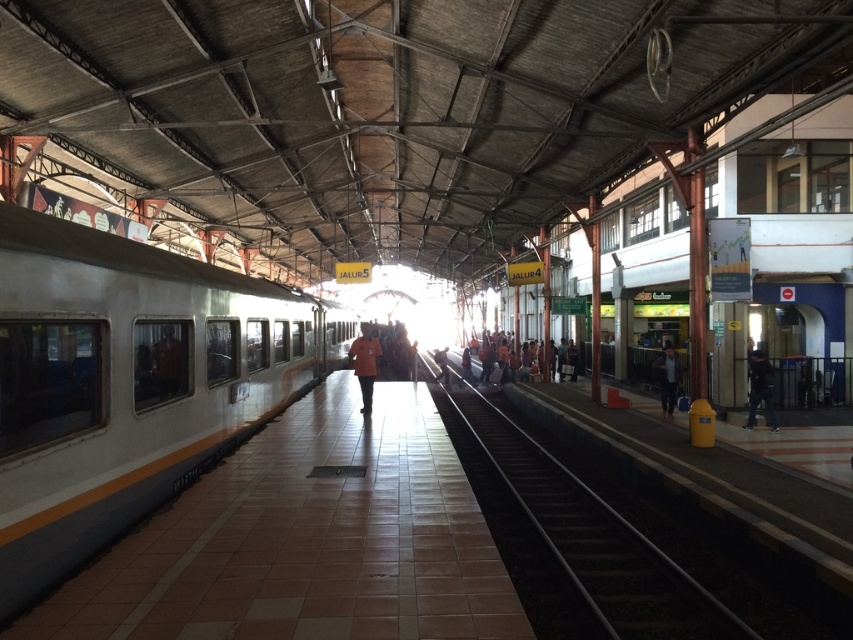
Question: Does silver metallic train at left have a smaller size compared to black matte person at right?

Choices:
 (A) no
 (B) yes

Answer: (A)

Question: Which point appears farthest from the camera in this image?

Choices:
 (A) (355, 340)
 (B) (674, 365)
 (C) (637, 548)

Answer: (B)

Question: Considering the real-world distances, which object is farthest from the dark blue jeans at lower right?

Choices:
 (A) orange fabric shirt at center
 (B) black matte person at right
 (C) orange fabric people at center

Answer: (A)

Question: Where is silver metallic train at left located in relation to orange fabric people at center in the image?

Choices:
 (A) below
 (B) above

Answer: (B)

Question: Does black matte person at right appear over dark blue jeans at lower right?

Choices:
 (A) yes
 (B) no

Answer: (B)

Question: Which point is closer to the camera taking this photo?

Choices:
 (A) (670, 406)
 (B) (693, 586)

Answer: (B)